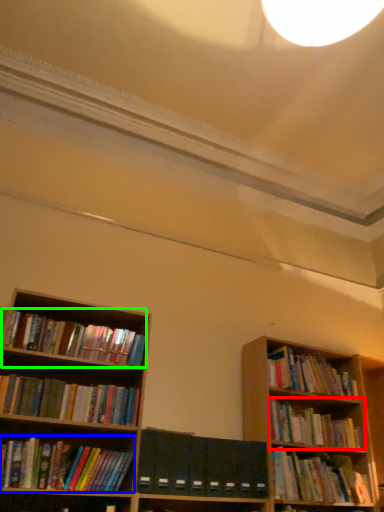
Question: Which object is the farthest from book (highlighted by a red box)? Choose among these: book (highlighted by a blue box) or book (highlighted by a green box).

Choices:
 (A) book
 (B) book

Answer: (B)